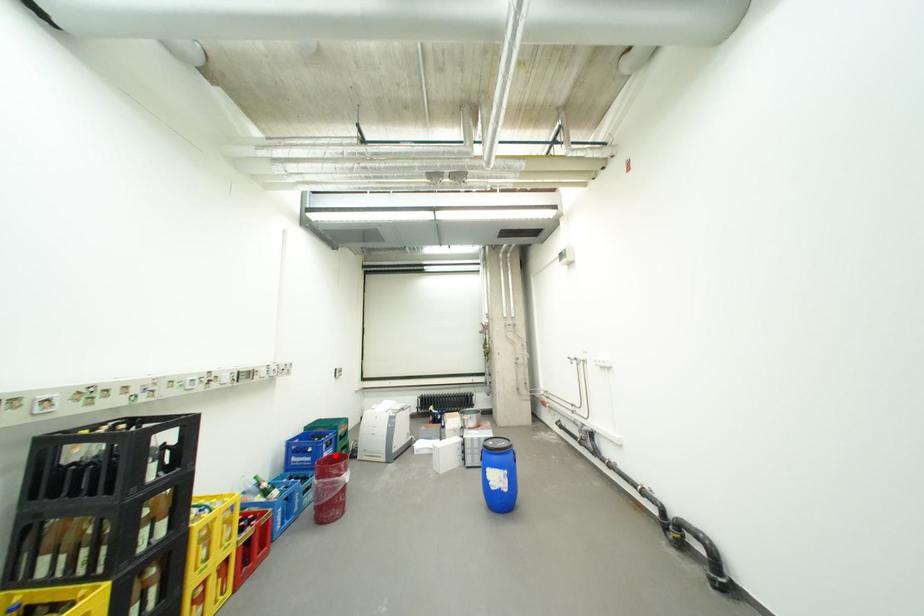
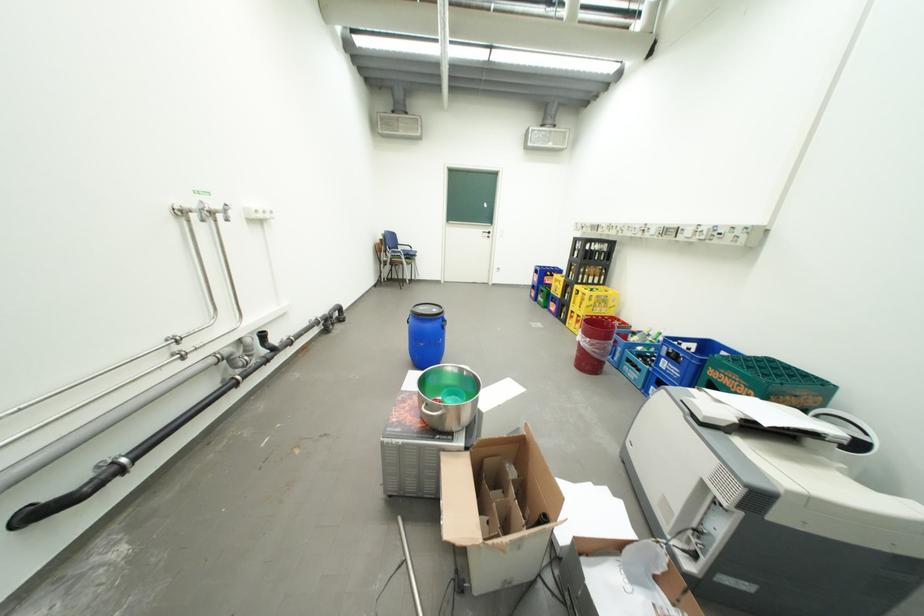
Where in the second image is the point corresponding to the highlighted location from the first image?

(674, 361)